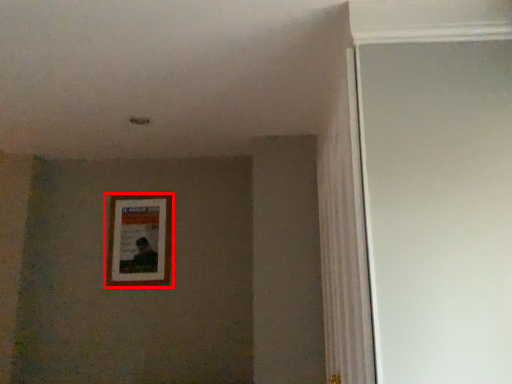
Question: In this image, where is picture frame (annotated by the red box) located relative to glass door?

Choices:
 (A) left
 (B) right

Answer: (A)